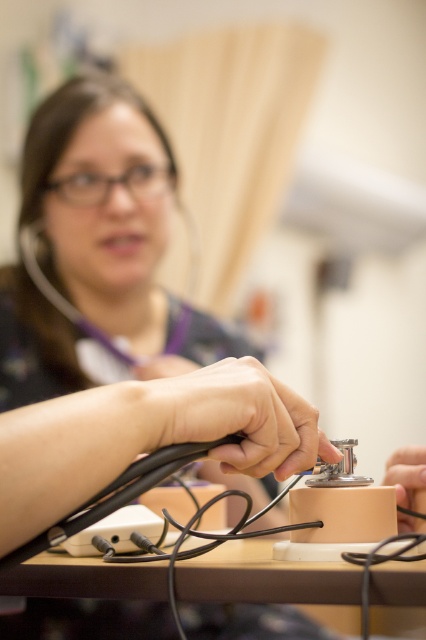
You are a medical student observing a demonstration. The instructor asks you to locate the wooden table at center. Using the coordinate system where the bottom left corner is the origin, can you confirm if the point at (88, 602) is the correct location for the wooden table at center?

Yes, the point at (88, 602) marks the wooden table at center according to the coordinates provided.

You are a medical student who needs to place the matte black stethoscope at lower right on the wooden table at center. Considering their sizes, will the stethoscope fit entirely on the table without hanging over the edges?

The wooden table at center is wider than the matte black stethoscope at lower right, so the stethoscope will fit entirely on the table without hanging over the edges.

Based on the photo, you are a medical student who needs to place the matte black stethoscope at center on a shelf that can only hold items up to the height of the wooden table at center. Can the stethoscope fit on the shelf?

The wooden table at center has a greater height compared to matte black stethoscope at center, so the stethoscope will fit on the shelf since its height is less than the table.